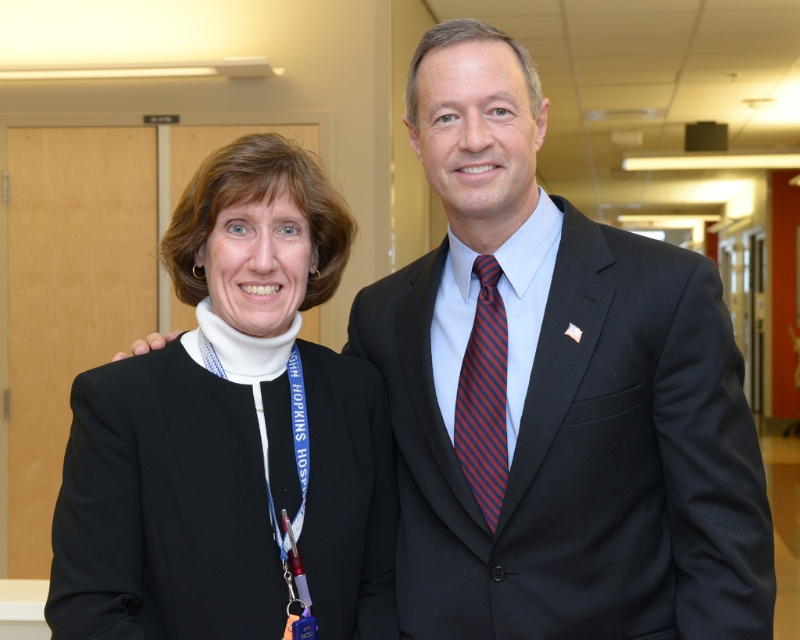
You are a photographer setting up a shoot in a professional environment. You have a matte black suit at center and a striped silk tie at center. Which item would cast a larger shadow if both are placed under the same lighting conditions?

The matte black suit at center has a larger size compared to striped silk tie at center, so it would cast a larger shadow under the same lighting conditions.

In the scene shown: What is the spatial relationship between the black woolen blazer at left and the point at (230, 433)?

The black woolen blazer at left is represented by the point at (230, 433).

You are a photographer setting up for a formal event. You need to ensure that both the matte black suit at center and the striped silk tie at center are visible in the frame. Based on their current positions, which one should you focus on first to ensure proper framing?

The matte black suit at center should be focused on first since it is in front of the striped silk tie at center, ensuring it doesn not block the view of the tie in the final shot.